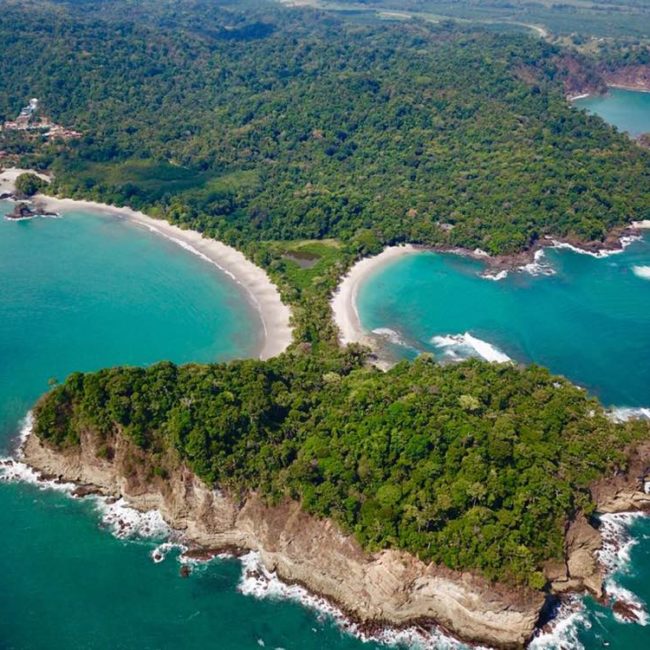
Identify the location of homes. The height and width of the screenshot is (650, 650). (20, 116), (45, 122).